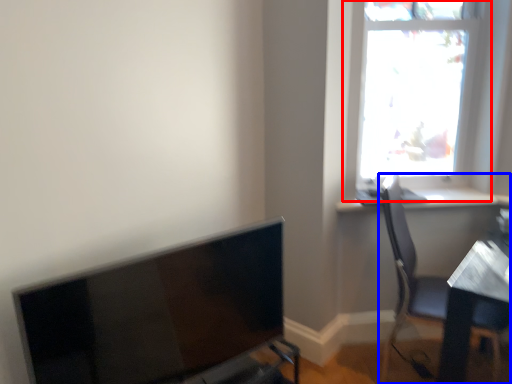
Question: Which object is further to the camera taking this photo, window (highlighted by a red box) or chair (highlighted by a blue box)?

Choices:
 (A) window
 (B) chair

Answer: (A)